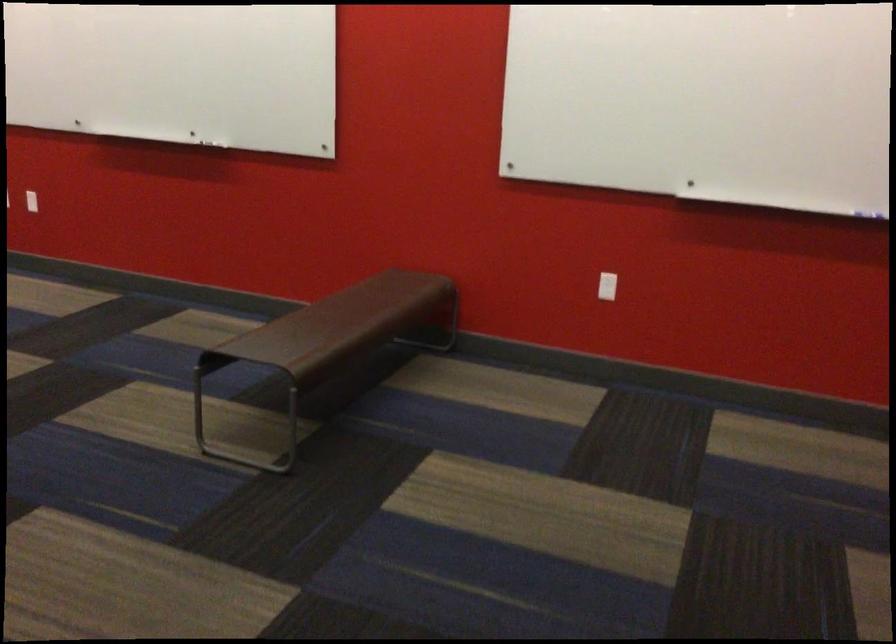
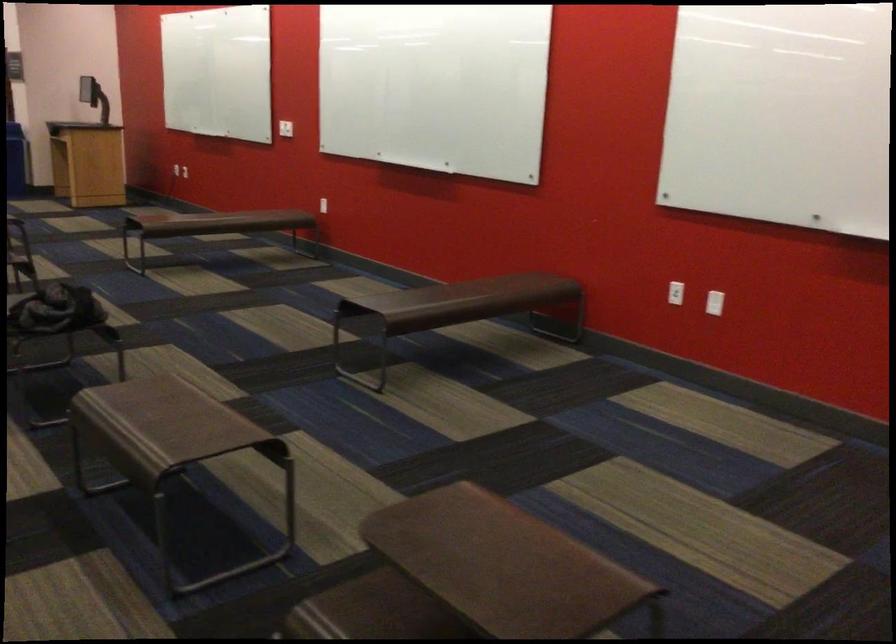
In a continuous first-person perspective shot, in which direction is the camera moving?

The cameraman moved toward left, forward.